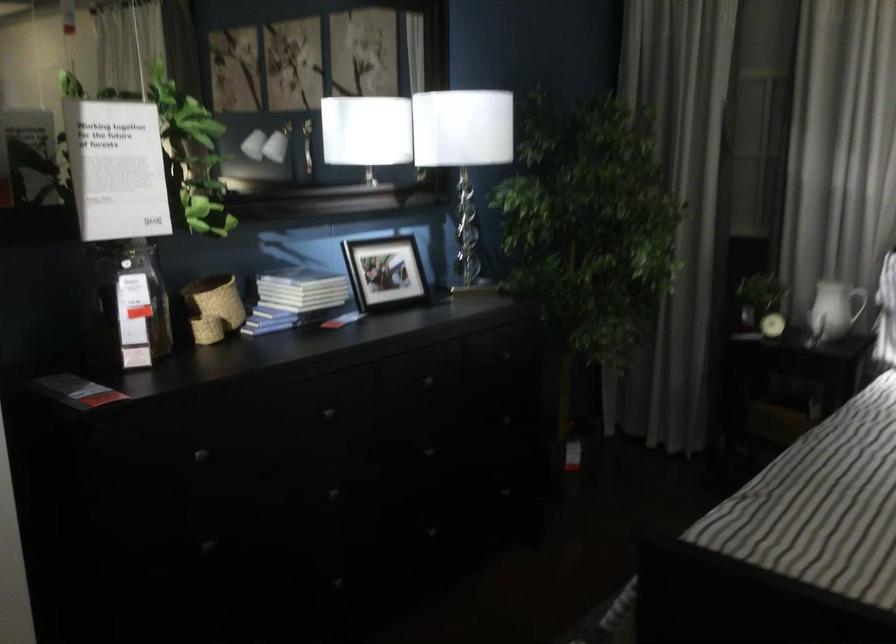
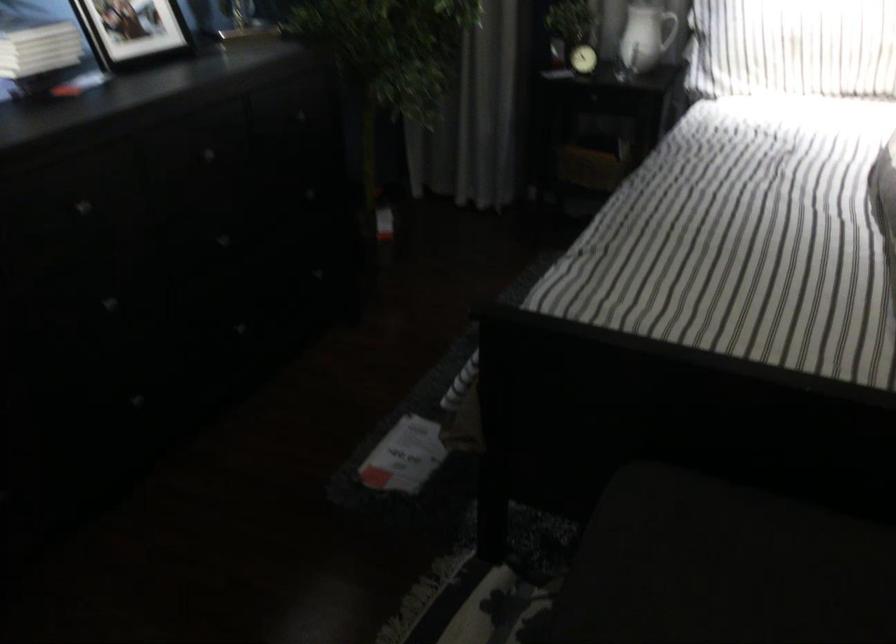
Question: The images are taken continuously from a first-person perspective. In which direction is your viewpoint rotating?

Choices:
 (A) Left
 (B) Right
 (C) Up
 (D) Down

Answer: (D)